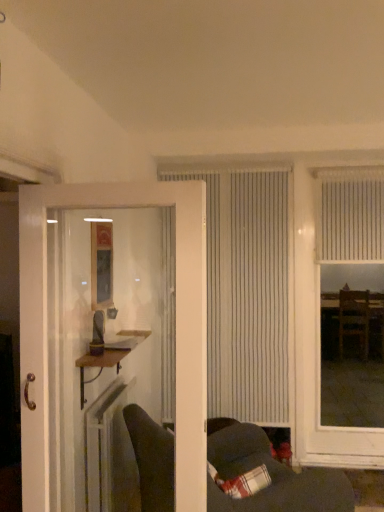
Question: Is white plastic radiator at lower left thinner than dark gray fabric couch at lower center?

Choices:
 (A) yes
 (B) no

Answer: (A)

Question: Considering the relative sizes of white plastic radiator at lower left and dark gray fabric couch at lower center in the image provided, is white plastic radiator at lower left shorter than dark gray fabric couch at lower center?

Choices:
 (A) yes
 (B) no

Answer: (A)

Question: Is dark gray fabric couch at lower center surrounded by white plastic radiator at lower left?

Choices:
 (A) no
 (B) yes

Answer: (A)

Question: From the image's perspective, does white plastic radiator at lower left appear higher than dark gray fabric couch at lower center?

Choices:
 (A) yes
 (B) no

Answer: (A)

Question: Is white plastic radiator at lower left positioned in front of dark gray fabric couch at lower center?

Choices:
 (A) yes
 (B) no

Answer: (B)

Question: From the image's perspective, does white plastic radiator at lower left appear lower than dark gray fabric couch at lower center?

Choices:
 (A) no
 (B) yes

Answer: (A)

Question: From a real-world perspective, is white textured blind at upper right below plaid fabric pillow at lower right?

Choices:
 (A) yes
 (B) no

Answer: (B)

Question: Is white textured blind at upper right wider than plaid fabric pillow at lower right?

Choices:
 (A) yes
 (B) no

Answer: (B)

Question: From the image's perspective, is white textured blind at upper right over plaid fabric pillow at lower right?

Choices:
 (A) yes
 (B) no

Answer: (A)

Question: Does white textured blind at upper right touch plaid fabric pillow at lower right?

Choices:
 (A) no
 (B) yes

Answer: (A)

Question: Is white textured blind at upper right facing away from plaid fabric pillow at lower right?

Choices:
 (A) yes
 (B) no

Answer: (B)

Question: Considering the relative positions of white textured blind at upper right and plaid fabric pillow at lower right in the image provided, is white textured blind at upper right to the right of plaid fabric pillow at lower right from the viewer's perspective?

Choices:
 (A) no
 (B) yes

Answer: (B)

Question: Is dark gray fabric couch at lower center closer to the viewer compared to white vertical blinds at center, the 1th window viewed from the left?

Choices:
 (A) no
 (B) yes

Answer: (B)